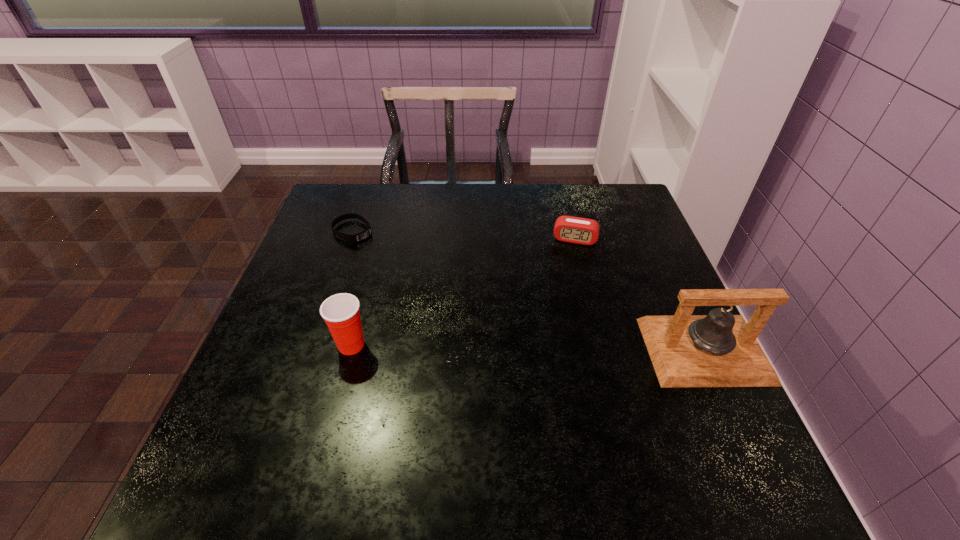
This screenshot has height=540, width=960. What are the coordinates of `the second tallest object` in the screenshot? It's located at (341, 313).

Locate an element on the screen. This screenshot has height=540, width=960. the tallest object is located at coordinates 720,349.

This screenshot has width=960, height=540. I want to click on bell, so click(720, 349).

Identify the location of the third object from left to right. (570, 229).

Locate an element on the screen. The height and width of the screenshot is (540, 960). alarm clock is located at coordinates (570, 229).

At what (x,y) coordinates should I click in order to perform the action: click on the shortest object. Please return your answer as a coordinate pair (x, y). This screenshot has height=540, width=960. Looking at the image, I should click on (355, 238).

This screenshot has width=960, height=540. Find the location of `vacant space positioned on the left of the third shortest object`. vacant space positioned on the left of the third shortest object is located at coordinates (269, 345).

Where is `blank area located 0.170m on the left of the tallest object`? This screenshot has width=960, height=540. blank area located 0.170m on the left of the tallest object is located at coordinates (567, 350).

I want to click on free spot located on the front-facing side of the second object from right to left, so click(566, 273).

Identify the location of vacant space located on the front-facing side of the second object from right to left. (550, 364).